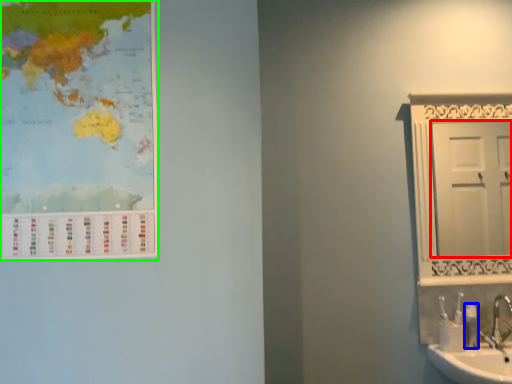
Question: Estimate the real-world distances between objects in this image. Which object is closer to door (highlighted by a red box), toiletry (highlighted by a blue box) or poster (highlighted by a green box)?

Choices:
 (A) toiletry
 (B) poster

Answer: (A)